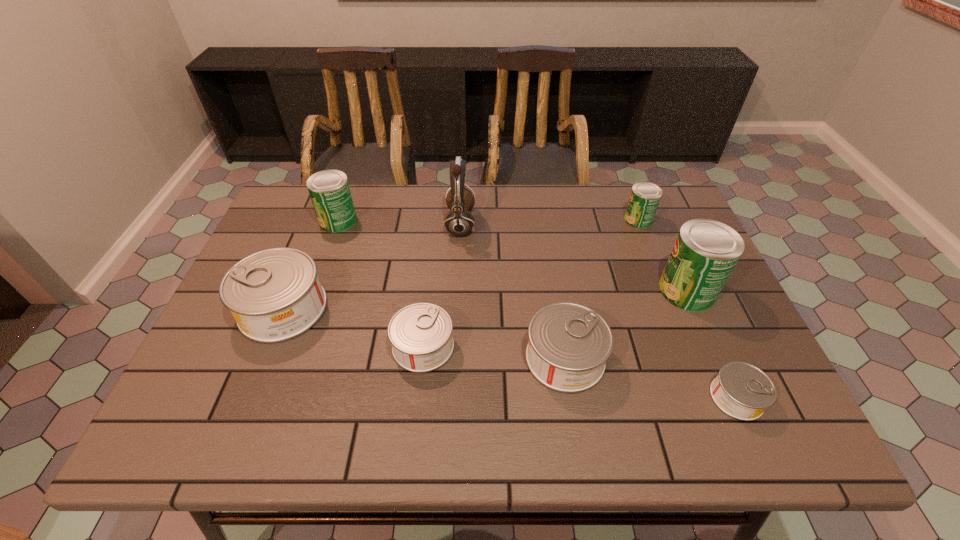
Where is `the seventh tallest object`? This screenshot has height=540, width=960. the seventh tallest object is located at coordinates (421, 337).

Where is `the second shortest can`? the second shortest can is located at coordinates [421, 337].

Where is `the shortest object`? The height and width of the screenshot is (540, 960). the shortest object is located at coordinates (742, 391).

This screenshot has width=960, height=540. What are the coordinates of `the rightmost silver can` in the screenshot? It's located at (742, 391).

Find the location of `free space located 0.140m on the ear pads of the tallest object`. free space located 0.140m on the ear pads of the tallest object is located at coordinates [521, 224].

What are the coordinates of `free space located on the back of the biggest green can` in the screenshot? It's located at (658, 224).

Locate an element on the screen. This screenshot has height=540, width=960. vacant region located on the back of the second smallest green can is located at coordinates (346, 199).

I want to click on vacant space located 0.400m on the right of the biggest silver can, so click(x=487, y=308).

Find the location of a particular element. The height and width of the screenshot is (540, 960). vacant area situated 0.210m on the left of the smallest green can is located at coordinates (555, 220).

The height and width of the screenshot is (540, 960). Find the location of `free space located 0.350m on the right of the fourth can from left to right`. free space located 0.350m on the right of the fourth can from left to right is located at coordinates (760, 358).